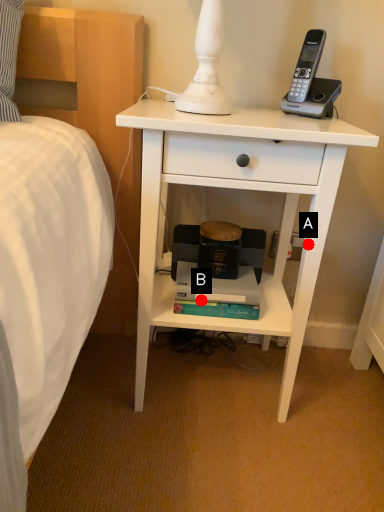
Question: Two points are circled on the image, labeled by A and B beside each circle. Among these points, which one is nearest to the camera?

Choices:
 (A) A is closer
 (B) B is closer

Answer: (A)